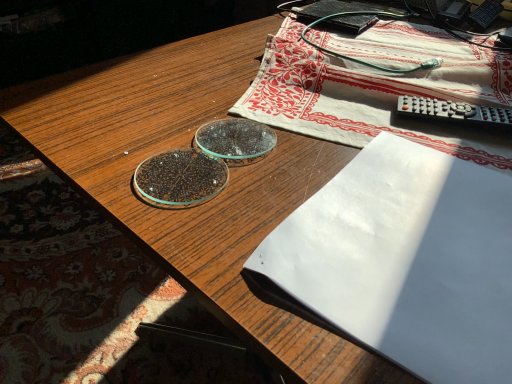
Question: Should I look upward or downward to see white paper at center?

Choices:
 (A) down
 (B) up

Answer: (A)

Question: Is black matte paperback book at upper right aimed at white paper at center?

Choices:
 (A) no
 (B) yes

Answer: (A)

Question: From a real-world perspective, is black matte paperback book at upper right located beneath white paper at center?

Choices:
 (A) yes
 (B) no

Answer: (A)

Question: Does black matte paperback book at upper right have a larger size compared to white paper at center?

Choices:
 (A) no
 (B) yes

Answer: (B)

Question: Does black matte paperback book at upper right touch white paper at center?

Choices:
 (A) no
 (B) yes

Answer: (A)

Question: From a real-world perspective, does black matte paperback book at upper right stand above white paper at center?

Choices:
 (A) yes
 (B) no

Answer: (B)

Question: Does black matte paperback book at upper right lie behind white paper at center?

Choices:
 (A) yes
 (B) no

Answer: (A)

Question: Considering the relative sizes of white cotton tablecloth at upper center and black matte paperback book at upper right in the image provided, is white cotton tablecloth at upper center bigger than black matte paperback book at upper right?

Choices:
 (A) yes
 (B) no

Answer: (A)

Question: Does white cotton tablecloth at upper center have a smaller size compared to black matte paperback book at upper right?

Choices:
 (A) yes
 (B) no

Answer: (B)

Question: Is white cotton tablecloth at upper center facing away from black matte paperback book at upper right?

Choices:
 (A) no
 (B) yes

Answer: (B)

Question: Does white cotton tablecloth at upper center appear on the right side of black matte paperback book at upper right?

Choices:
 (A) no
 (B) yes

Answer: (B)

Question: From a real-world perspective, is white cotton tablecloth at upper center on black matte paperback book at upper right?

Choices:
 (A) yes
 (B) no

Answer: (A)

Question: Does white cotton tablecloth at upper center have a lesser width compared to black matte paperback book at upper right?

Choices:
 (A) yes
 (B) no

Answer: (B)

Question: Are white paper at center and white cotton tablecloth at upper center beside each other?

Choices:
 (A) yes
 (B) no

Answer: (B)